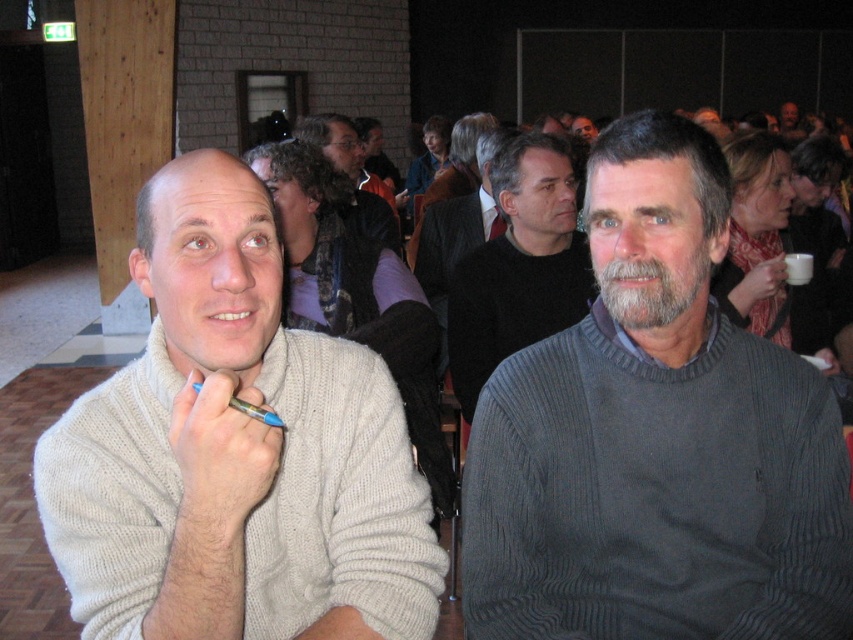
Can you confirm if dark gray ribbed sweater at center is positioned to the right of dark gray sweater at center?

Yes, dark gray ribbed sweater at center is to the right of dark gray sweater at center.

Locate an element on the screen. Image resolution: width=853 pixels, height=640 pixels. dark gray ribbed sweater at center is located at coordinates (656, 438).

Based on the photo, can you confirm if dark gray ribbed sweater at center is positioned to the left of dark brown sweater at center?

No, dark gray ribbed sweater at center is not to the left of dark brown sweater at center.

The height and width of the screenshot is (640, 853). I want to click on dark gray ribbed sweater at center, so click(656, 438).

Between dark gray ribbed sweater at center and beige knitted sweater at left, which one has less height?

beige knitted sweater at left is shorter.

In the scene shown: Does dark gray ribbed sweater at center have a smaller size compared to beige knitted sweater at left?

Indeed, dark gray ribbed sweater at center has a smaller size compared to beige knitted sweater at left.

Who is more distant from viewer, (786, 509) or (409, 493)?

The point (786, 509) is more distant.

Locate an element on the screen. The width and height of the screenshot is (853, 640). dark gray ribbed sweater at center is located at coordinates (656, 438).